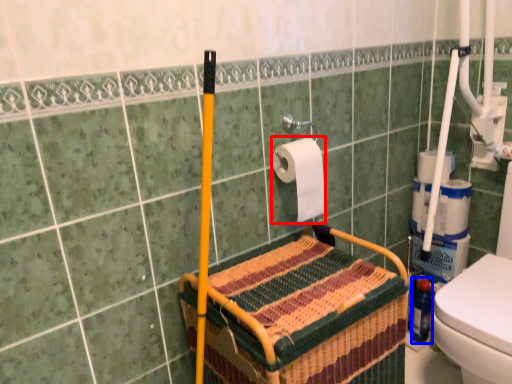
Question: Which point is closer to the camera, toilet paper (highlighted by a red box) or bottle (highlighted by a blue box)?

Choices:
 (A) toilet paper
 (B) bottle

Answer: (A)